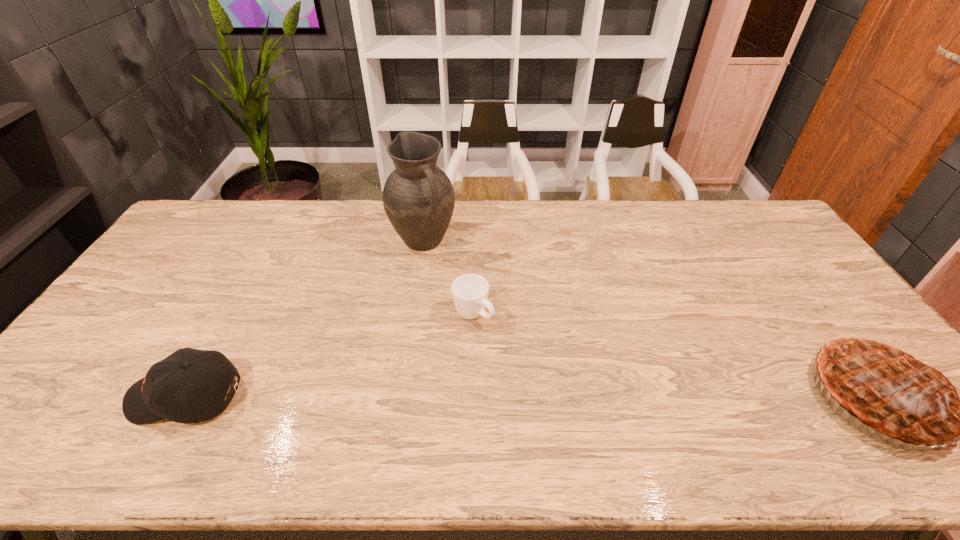
The width and height of the screenshot is (960, 540). I want to click on vacant space situated 0.050m on the side of the farthest object with the handle, so click(x=444, y=269).

What are the coordinates of `vacant space located 0.140m with the handle on the side of the cup` in the screenshot? It's located at (524, 357).

The image size is (960, 540). I want to click on vacant space located with the handle on the side of the cup, so click(x=575, y=399).

Identify the location of free location located 0.160m with the handle on the side of the cup. (530, 361).

Locate an element on the screen. object located at the far edge is located at coordinates (418, 197).

Identify the location of object at the near edge. The image size is (960, 540). (186, 374).

Where is `vacant space at the far edge of the desktop`? This screenshot has height=540, width=960. vacant space at the far edge of the desktop is located at coordinates (327, 213).

This screenshot has height=540, width=960. Identify the location of vacant space at the left edge. (156, 267).

In order to click on free space at the right edge of the desktop in this screenshot , I will do (x=762, y=264).

Image resolution: width=960 pixels, height=540 pixels. Identify the location of vacant position at the near left corner of the desktop. (70, 393).